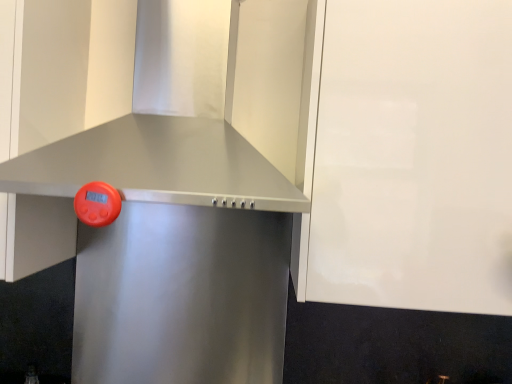
At what (x,y) coordinates should I click in order to perform the action: click on vacant region above satin metallic range hood at center (from a real-world perspective). Please return your answer as a coordinate pair (x, y). This screenshot has height=384, width=512. Looking at the image, I should click on click(x=195, y=205).